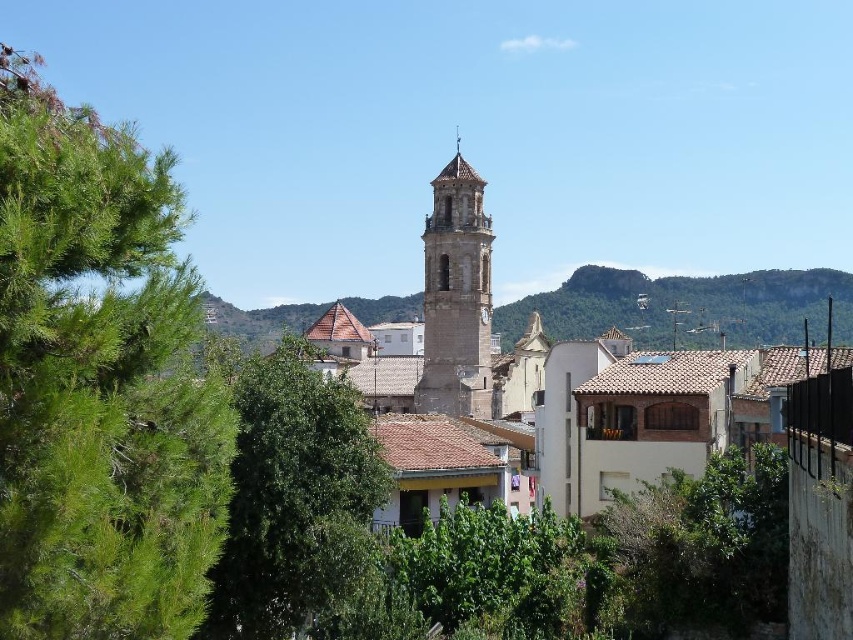
Question: Is green leafy tree at lower left further to camera compared to smooth stone bell tower at center?

Choices:
 (A) yes
 (B) no

Answer: (B)

Question: Which object appears farthest from the camera in this image?

Choices:
 (A) green needle-like leaves at left
 (B) smooth stone bell tower at center

Answer: (B)

Question: Is the position of green needle-like leaves at left more distant than that of smooth stone bell tower at center?

Choices:
 (A) yes
 (B) no

Answer: (B)

Question: Which point is closer to the camera taking this photo?

Choices:
 (A) (306, 547)
 (B) (44, 131)
 (C) (453, 182)

Answer: (B)

Question: Is green leafy tree at lower left wider than smooth stone bell tower at center?

Choices:
 (A) no
 (B) yes

Answer: (B)

Question: Which object is the farthest from the green leafy tree at lower left?

Choices:
 (A) green needle-like leaves at left
 (B) smooth stone bell tower at center

Answer: (B)